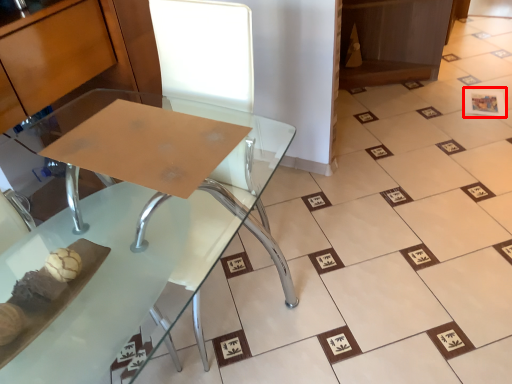
Question: From the image's perspective, what is the correct spatial relationship of square (annotated by the red box) in relation to table?

Choices:
 (A) below
 (B) above

Answer: (B)